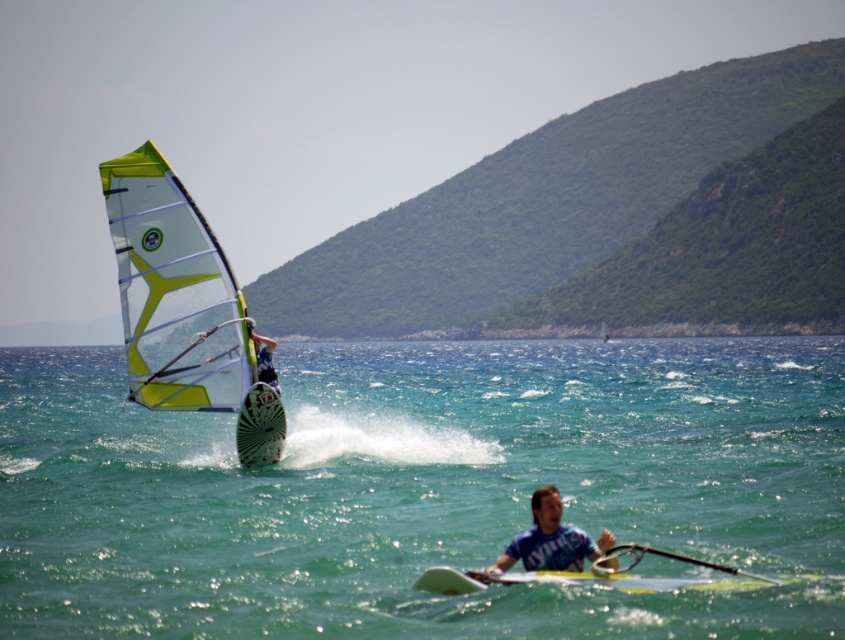
Question: Among these points, which one is farthest from the camera?

Choices:
 (A) (275, 342)
 (B) (541, 524)
 (C) (155, 282)
 (D) (810, 534)

Answer: (C)

Question: Which of the following is the closest to the observer?

Choices:
 (A) (206, 397)
 (B) (500, 564)
 (C) (456, 608)

Answer: (B)

Question: Which object is the farthest from the transparent plastic sail at left?

Choices:
 (A) blue jersey at center
 (B) clear blue water at center
 (C) yellow-green sail at upper left

Answer: (B)

Question: Is clear blue water at center closer to the viewer compared to yellow-green sail at upper left?

Choices:
 (A) yes
 (B) no

Answer: (A)

Question: Can you confirm if transparent plastic sail at left is bigger than blue jersey at center?

Choices:
 (A) no
 (B) yes

Answer: (A)

Question: Is clear blue water at center above transparent plastic sail at left?

Choices:
 (A) no
 (B) yes

Answer: (A)